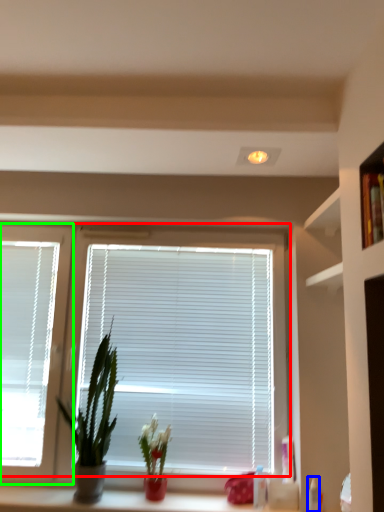
Question: Considering the real-world distances, which object is farthest from window blind (highlighted by a red box)? toiletry (highlighted by a blue box) or window (highlighted by a green box)?

Choices:
 (A) toiletry
 (B) window

Answer: (A)